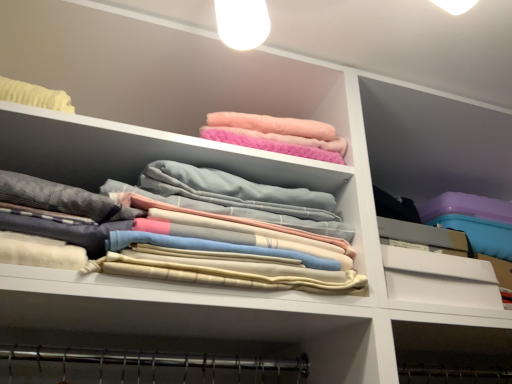
Question: Is point click(12, 226) closer or farther from the camera than point click(494, 274)?

Choices:
 (A) closer
 (B) farther

Answer: (A)

Question: In terms of height, does soft pastel fabric at center look taller or shorter compared to white matte drawer at right?

Choices:
 (A) tall
 (B) short

Answer: (A)

Question: Looking at their shapes, would you say soft pastel fabric at center is wider or thinner than white matte drawer at right?

Choices:
 (A) thin
 (B) wide

Answer: (B)

Question: In terms of width, does white matte drawer at right look wider or thinner when compared to soft pastel fabric at center?

Choices:
 (A) thin
 (B) wide

Answer: (A)

Question: Would you say white matte drawer at right is to the left or to the right of soft pastel fabric at center in the picture?

Choices:
 (A) left
 (B) right

Answer: (B)

Question: Is point (398, 271) positioned closer to the camera than point (147, 269)?

Choices:
 (A) closer
 (B) farther

Answer: (B)

Question: Is white matte drawer at right bigger or smaller than soft pastel fabric at center?

Choices:
 (A) small
 (B) big

Answer: (A)